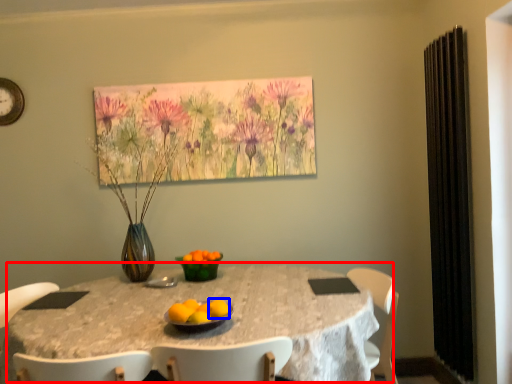
Question: Which point is further to the camera, table (highlighted by a red box) or orange (highlighted by a blue box)?

Choices:
 (A) table
 (B) orange

Answer: (B)